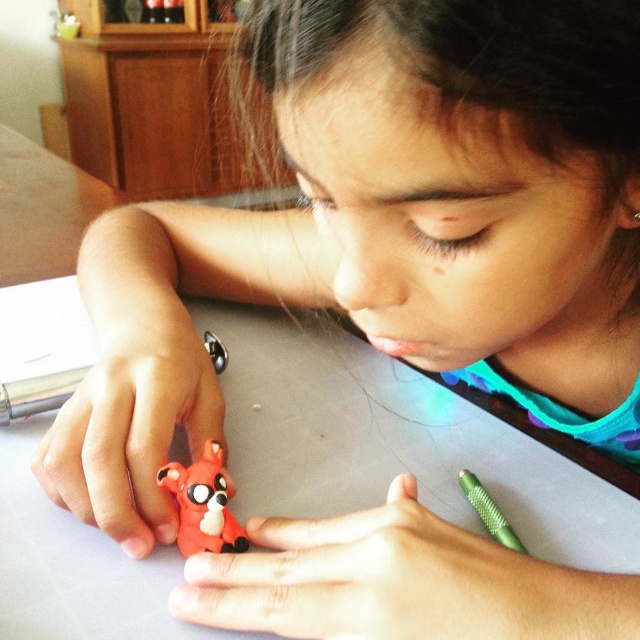
How much distance is there between rubberized red fox at center and green metallic pencil at lower right?

rubberized red fox at center is 6.19 inches from green metallic pencil at lower right.

Who is shorter, rubberized red fox at center or green metallic pencil at lower right?

Standing shorter between the two is green metallic pencil at lower right.

Which is behind, point (195, 483) or point (460, 468)?

Positioned behind is point (460, 468).

Find the location of a particular element. This screenshot has width=640, height=640. rubberized red fox at center is located at coordinates (202, 504).